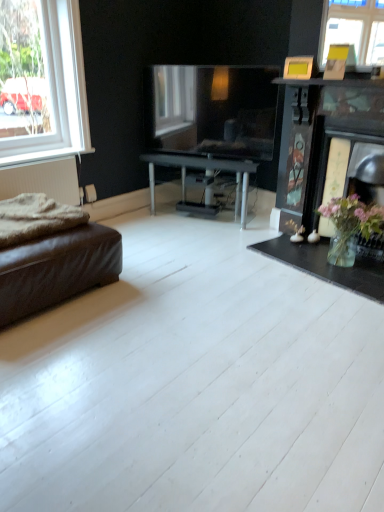
Find the location of a particular element. free space to the right of brown leather studio couch at lower left is located at coordinates (191, 274).